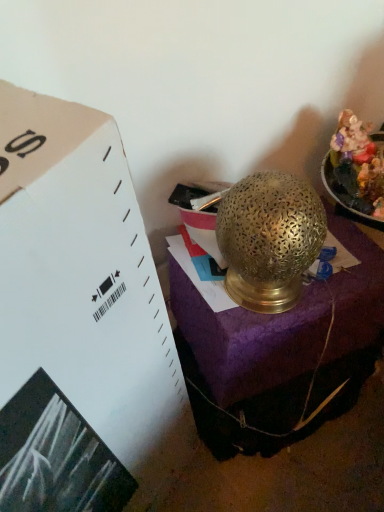
Question: Based on their positions, is shiny metallic food at upper right located to the left or right of gold textured lamp at center?

Choices:
 (A) left
 (B) right

Answer: (B)

Question: From the image's perspective, is shiny metallic food at upper right above or below gold textured lamp at center?

Choices:
 (A) below
 (B) above

Answer: (B)

Question: Estimate the real-world distances between objects in this image. Which object is farther from the shiny metallic food at upper right?

Choices:
 (A) gold textured lamp at center
 (B) gold textured lamp at center

Answer: (A)

Question: Which of these objects is positioned farthest from the shiny metallic food at upper right?

Choices:
 (A) gold textured lamp at center
 (B) gold textured lamp at center

Answer: (A)